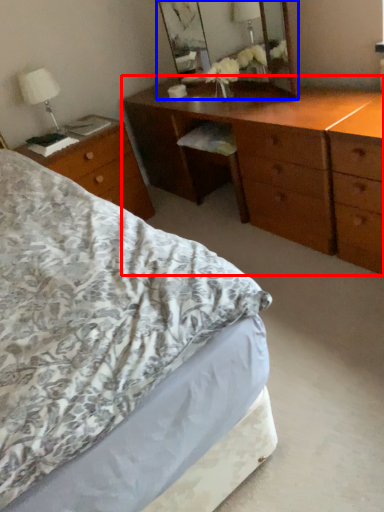
Question: Which of the following is the farthest to the observer, chest of drawers (highlighted by a red box) or mirror (highlighted by a blue box)?

Choices:
 (A) chest of drawers
 (B) mirror

Answer: (B)